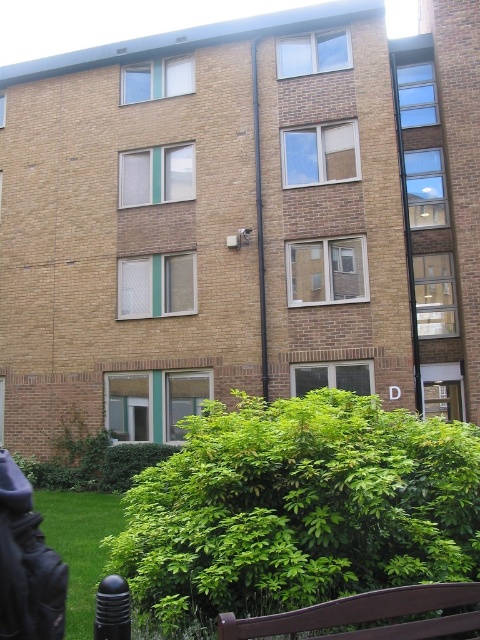
You are standing in front of the multi story brick building and want to plant a new bush exactly where the green leafy bush at center is currently located. Can you tell me the coordinates of where you should plant the new bush?

The green leafy bush at center is located at point (299, 508) so you should plant the new bush at those coordinates.

You are standing in front of the building and want to know which of the two points, point (x=430, y=552) or point (x=474, y=600), is closer to you. Based on the building description, can you determine which point is nearer?

Point (x=430, y=552) is closer to you because it is further to the viewer than point (x=474, y=600).

You are a visitor approaching the building and want to sit on the brown wooden bench at lower center. Is the green leafy bush at center blocking your path to the bench?

The brown wooden bench at lower center is behind the green leafy bush at center, so the bush is blocking the path to the bench.